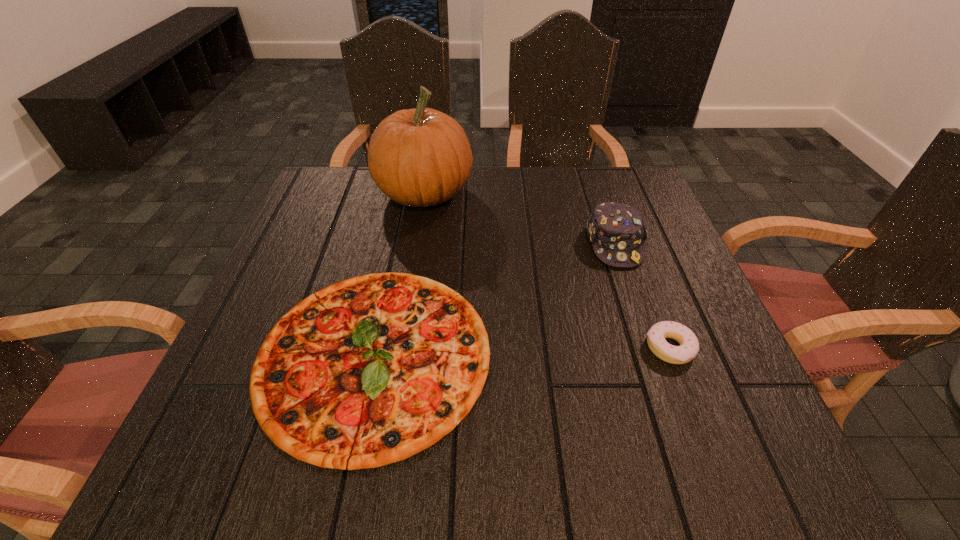
Select which object appears as the closest to the headwear. Please provide its 2D coordinates. Your answer should be formatted as a tuple, i.e. [(x, y)], where the tuple contains the x and y coordinates of a point satisfying the conditions above.

[(689, 346)]

This screenshot has width=960, height=540. What are the coordinates of `free location that satisfies the following two spatial constraints: 1. on the back side of the doughnut; 2. on the left side of the pizza` in the screenshot? It's located at (375, 348).

Find the location of a particular element. vacant area in the image that satisfies the following two spatial constraints: 1. on the back side of the third tallest object; 2. on the stem of the tallest object is located at coordinates (612, 194).

In order to click on free space that satisfies the following two spatial constraints: 1. on the stem of the tallest object; 2. on the left side of the second shortest object in this screenshot , I will do `click(399, 348)`.

Image resolution: width=960 pixels, height=540 pixels. Identify the location of free space that satisfies the following two spatial constraints: 1. on the stem of the pumpkin; 2. on the left side of the doughnut. (399, 348).